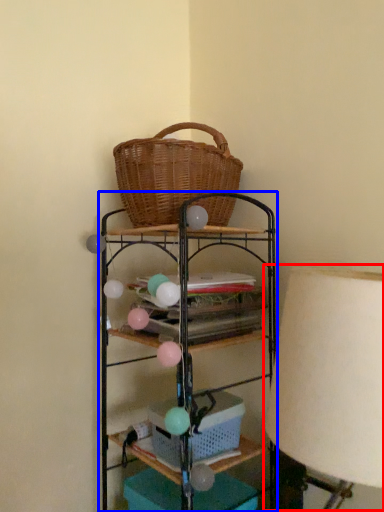
Question: Among these objects, which one is nearest to the camera, table lamp (highlighted by a red box) or shelf (highlighted by a blue box)?

Choices:
 (A) table lamp
 (B) shelf

Answer: (A)